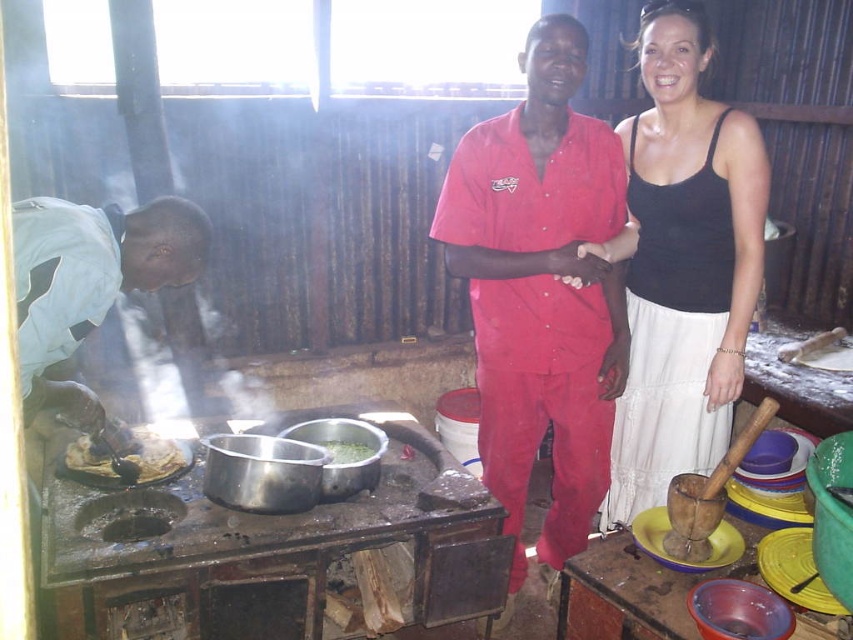
Question: Is brown matte food at lower left closer to camera compared to green matte pot at center?

Choices:
 (A) yes
 (B) no

Answer: (A)

Question: Where is brown matte food at lower left located in relation to green matte pot at center in the image?

Choices:
 (A) below
 (B) above

Answer: (B)

Question: Which point is closer to the camera?

Choices:
 (A) (137, 465)
 (B) (329, 445)
 (C) (612, 252)

Answer: (C)

Question: Which object is closer to the camera taking this photo?

Choices:
 (A) green matte pot at center
 (B) matte red shirt at center
 (C) brown matte food at lower left

Answer: (B)

Question: Among these points, which one is nearest to the camera?

Choices:
 (A) [680, 140]
 (B) [321, 445]
 (C) [712, 225]
 (D) [158, 451]

Answer: (C)

Question: Is brown matte food at lower left above green matte pot at center?

Choices:
 (A) no
 (B) yes

Answer: (B)